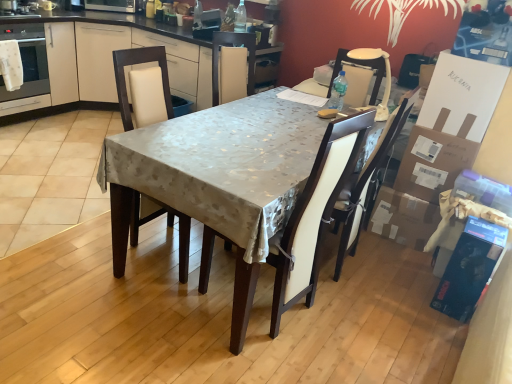
You are a GUI agent. You are given a task and a screenshot of the screen. Output one action in this format:
    pyautogui.click(x=<x>, y=<y>)
    Task: Click on the free space in front of matte white chair at center, placed as the third chair when sorted from right to left
    Image resolution: width=512 pixels, height=384 pixels.
    Given the screenshot: What is the action you would take?
    pyautogui.click(x=144, y=299)